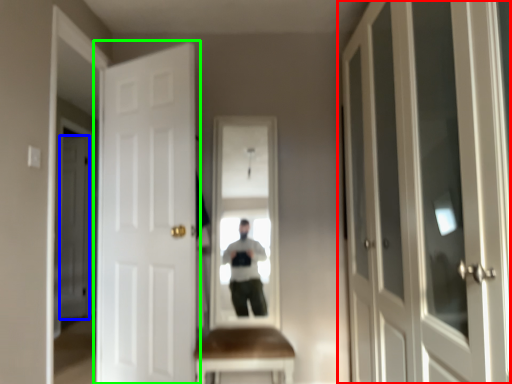
Question: Based on their relative distances, which object is farther from door (highlighted by a red box)? Choose from door (highlighted by a blue box) and door (highlighted by a green box).

Choices:
 (A) door
 (B) door

Answer: (A)